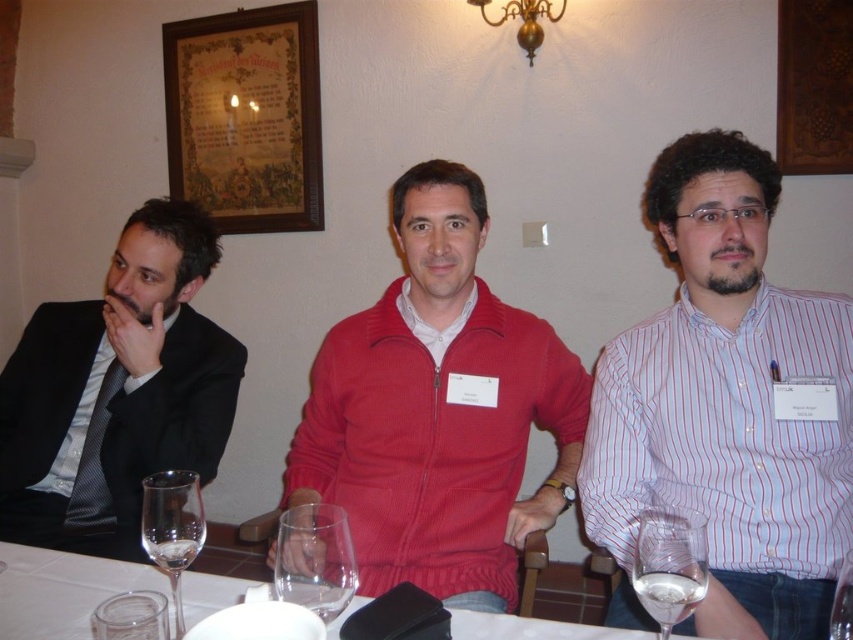
Question: Considering the relative positions of white striped shirt at center and red corduroy sweater at center in the image provided, where is white striped shirt at center located with respect to red corduroy sweater at center?

Choices:
 (A) left
 (B) right

Answer: (B)

Question: Can you confirm if transparent glass at center is wider than clear glass wine glass at lower right?

Choices:
 (A) yes
 (B) no

Answer: (A)

Question: Among these points, which one is nearest to the camera?

Choices:
 (A) (204, 99)
 (B) (312, 564)
 (C) (131, 436)

Answer: (B)

Question: Which object is closer to the camera taking this photo?

Choices:
 (A) red corduroy sweater at center
 (B) white glossy table at center

Answer: (B)

Question: Is red corduroy sweater at center to the left of transparent glass at lower left from the viewer's perspective?

Choices:
 (A) no
 (B) yes

Answer: (A)

Question: Which point is closer to the camera taking this photo?

Choices:
 (A) (231, 220)
 (B) (280, 516)
 (C) (393, 552)

Answer: (B)